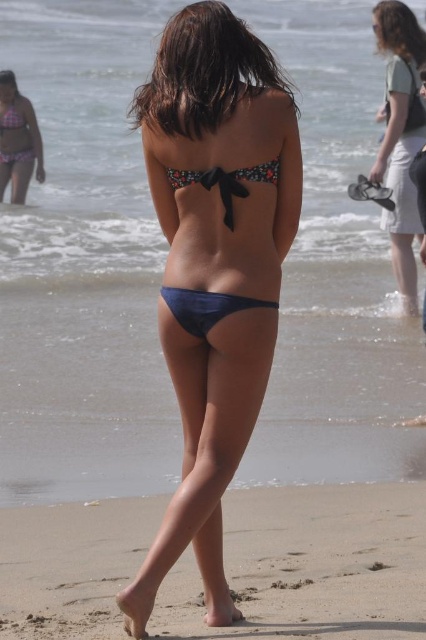
Question: In this image, where is blue matte bikini at center located relative to patterned fabric bikini top at upper left?

Choices:
 (A) left
 (B) right

Answer: (B)

Question: Is blue matte bikini at center to the left of floral fabric bikini top at upper center from the viewer's perspective?

Choices:
 (A) yes
 (B) no

Answer: (B)

Question: Estimate the real-world distances between objects in this image. Which object is closer to the floral fabric bikini top at upper center?

Choices:
 (A) matte floral bikini top at center
 (B) blue matte bikini at center
 (C) patterned fabric bikini top at upper left
 (D) matte black bikini top at upper center

Answer: (C)

Question: Among these points, which one is nearest to the camera?

Choices:
 (A) (14, 156)
 (B) (178, 300)
 (C) (224, 577)
 (D) (402, 237)

Answer: (B)

Question: Which of the following is the closest to the observer?

Choices:
 (A) (299, 634)
 (B) (394, 172)

Answer: (A)

Question: Is matte black bikini top at upper center smaller than patterned fabric bikini top at upper left?

Choices:
 (A) no
 (B) yes

Answer: (B)